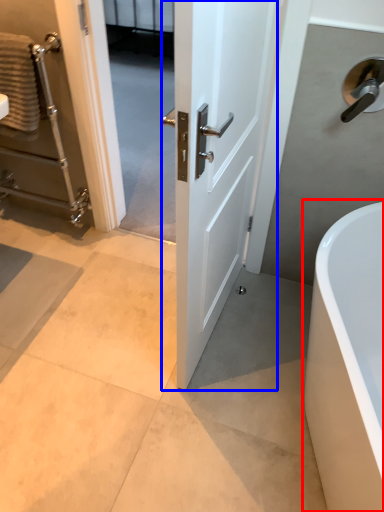
Question: Which point is closer to the camera, bathtub (highlighted by a red box) or door (highlighted by a blue box)?

Choices:
 (A) bathtub
 (B) door

Answer: (B)